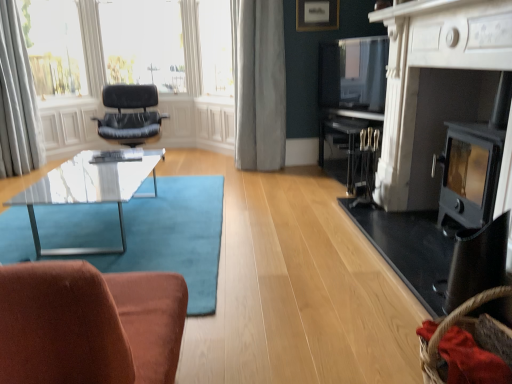
Question: Is matte gold picture frame at upper center positioned far away from teal carpet at center?

Choices:
 (A) no
 (B) yes

Answer: (B)

Question: From the image's perspective, is matte gold picture frame at upper center above teal carpet at center?

Choices:
 (A) yes
 (B) no

Answer: (A)

Question: From the image's perspective, is matte gold picture frame at upper center located beneath teal carpet at center?

Choices:
 (A) yes
 (B) no

Answer: (B)

Question: Can you confirm if matte gold picture frame at upper center is taller than teal carpet at center?

Choices:
 (A) yes
 (B) no

Answer: (B)

Question: Is matte gold picture frame at upper center shorter than teal carpet at center?

Choices:
 (A) yes
 (B) no

Answer: (A)

Question: Can you confirm if matte gold picture frame at upper center is positioned to the left of teal carpet at center?

Choices:
 (A) yes
 (B) no

Answer: (B)

Question: Is white sheer curtains at upper left further to the viewer compared to black metal fireplace at right, the 1th fireplace in the back-to-front sequence?

Choices:
 (A) yes
 (B) no

Answer: (A)

Question: Is white sheer curtains at upper left not near black metal fireplace at right, the 2th fireplace when ordered from front to back?

Choices:
 (A) no
 (B) yes

Answer: (B)

Question: From a real-world perspective, is white sheer curtains at upper left below black metal fireplace at right, the 1th fireplace in the back-to-front sequence?

Choices:
 (A) no
 (B) yes

Answer: (A)

Question: Considering the relative sizes of white sheer curtains at upper left and black metal fireplace at right, the 1th fireplace in the back-to-front sequence, in the image provided, is white sheer curtains at upper left smaller than black metal fireplace at right, the 1th fireplace in the back-to-front sequence,?

Choices:
 (A) yes
 (B) no

Answer: (B)

Question: Is white sheer curtains at upper left positioned beyond the bounds of black metal fireplace at right, the 1th fireplace in the back-to-front sequence?

Choices:
 (A) no
 (B) yes

Answer: (B)

Question: Considering the relative sizes of white sheer curtains at upper left and black metal fireplace at right, the 2th fireplace when ordered from front to back, in the image provided, is white sheer curtains at upper left shorter than black metal fireplace at right, the 2th fireplace when ordered from front to back,?

Choices:
 (A) no
 (B) yes

Answer: (A)

Question: From a real-world perspective, is teal carpet at center on white sheer curtains at upper left?

Choices:
 (A) yes
 (B) no

Answer: (B)